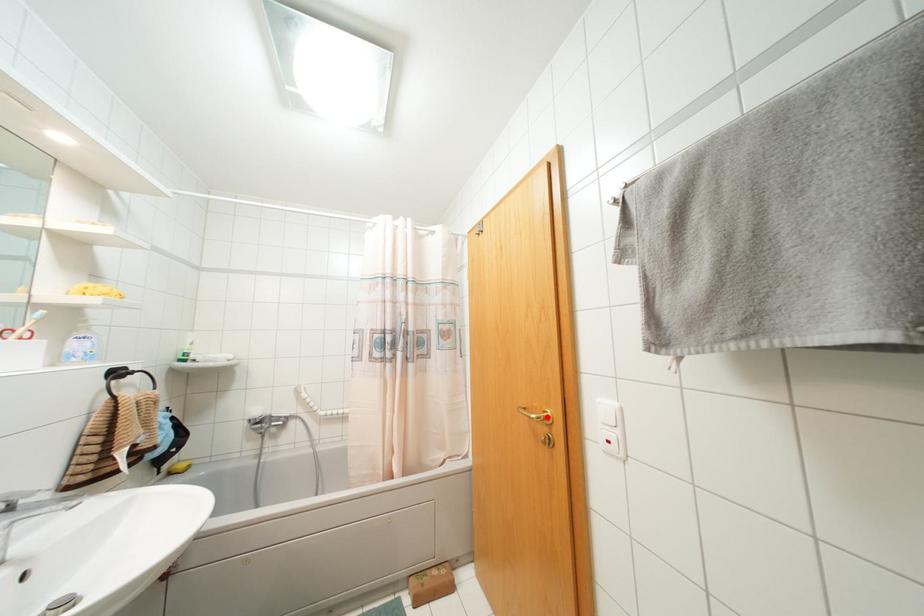
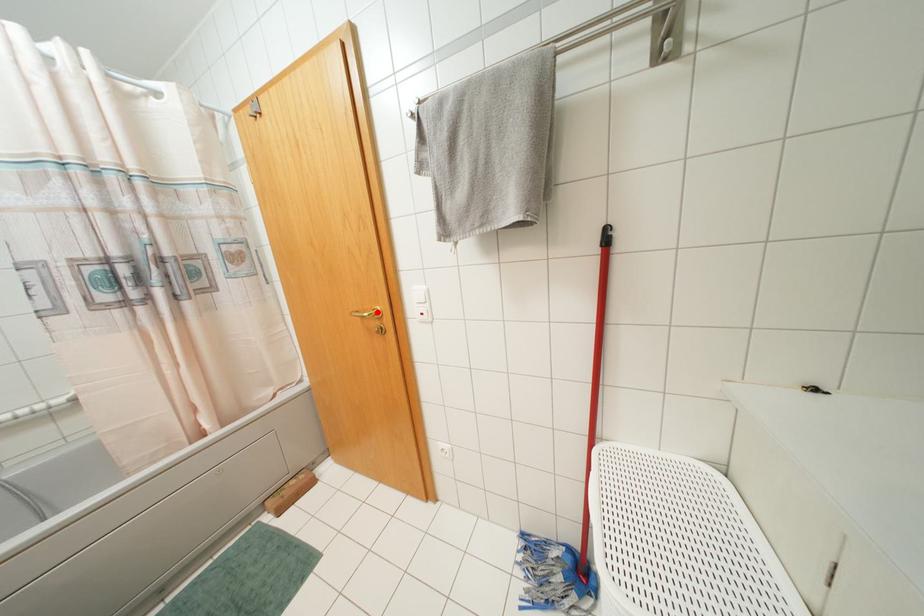
I am providing you with two images of the same scene from different viewpoints. A red point is marked on the first image and another point is marked on the second image. Do the highlighted points in image1 and image2 indicate the same real-world spot?

Yes